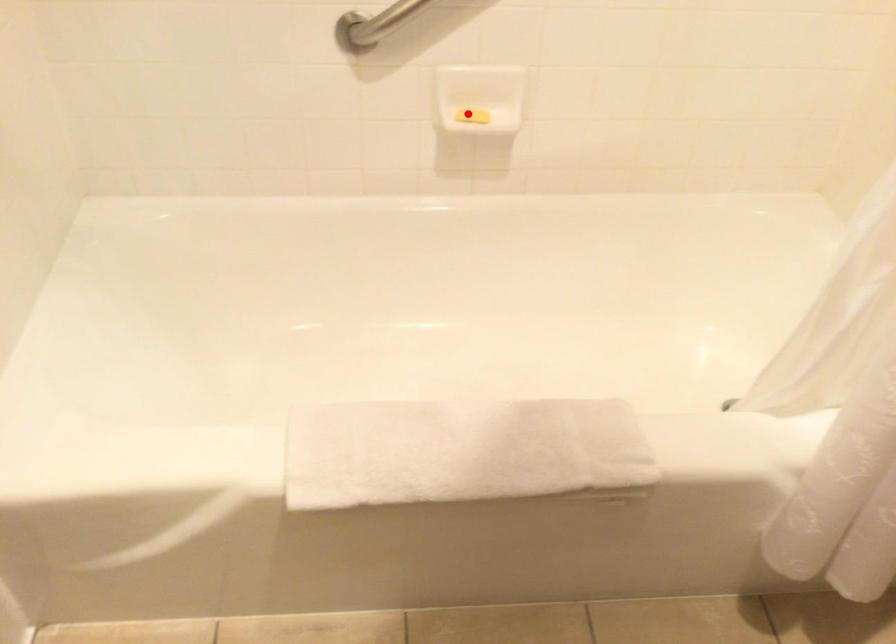
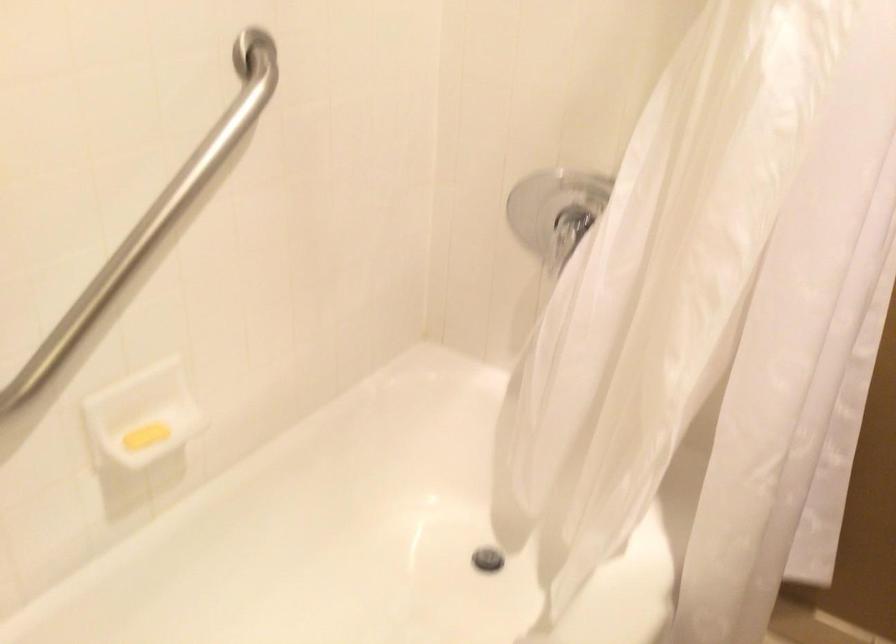
Question: I am providing you with two images of the same scene from different viewpoints. In image1, a red point is highlighted. Considering the same 3D point in image2, which of the following is correct?

Choices:
 (A) It is closer
 (B) It is farther

Answer: (A)